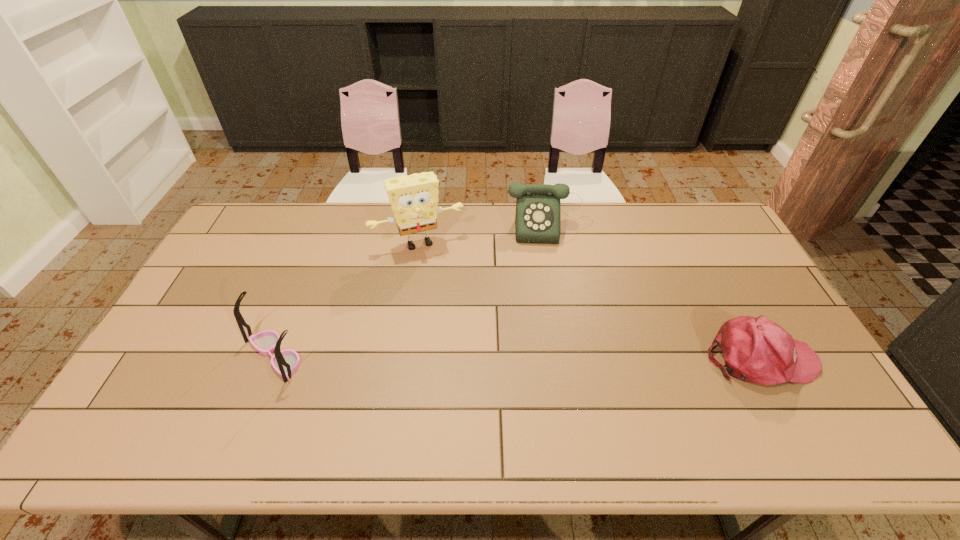
The height and width of the screenshot is (540, 960). I want to click on the leftmost object, so click(286, 362).

The width and height of the screenshot is (960, 540). Identify the location of baseball cap. (757, 350).

Where is `the rightmost object`? This screenshot has height=540, width=960. the rightmost object is located at coordinates (757, 350).

At what (x,y) coordinates should I click in order to perform the action: click on telephone. Please return your answer as a coordinate pair (x, y). Looking at the image, I should click on (538, 207).

This screenshot has width=960, height=540. In order to click on sponge in this screenshot , I will do `click(414, 199)`.

You are a GUI agent. You are given a task and a screenshot of the screen. Output one action in this format:
    pyautogui.click(x=<x>, y=<y>)
    Task: Click on the tallest object
    The height and width of the screenshot is (540, 960).
    Given the screenshot: What is the action you would take?
    coord(414,199)

Locate an element on the screen. free space located on the left of the leftmost object is located at coordinates (218, 355).

Find the location of a particular element. blank space located on the dial of the telephone is located at coordinates (559, 306).

Where is `vacant point located on the dial of the telephone`? vacant point located on the dial of the telephone is located at coordinates (561, 327).

In order to click on free space located 0.120m on the dial of the telephone in this screenshot , I will do `click(555, 269)`.